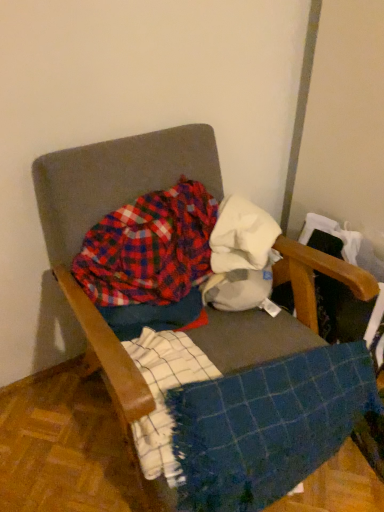
Question: In the image, is blue woven blanket at center on the left side or the right side of plaid cotton shirt at center?

Choices:
 (A) right
 (B) left

Answer: (A)

Question: Relative to plaid cotton shirt at center, is blue woven blanket at center in front or behind?

Choices:
 (A) front
 (B) behind

Answer: (A)

Question: Considering the real-world distances, which object is closest to the textured fabric chair at center?

Choices:
 (A) plaid cotton shirt at center
 (B) white cotton cloth at center
 (C) blue woven blanket at center

Answer: (A)

Question: Estimate the real-world distances between objects in this image. Which object is closer to the textured fabric chair at center?

Choices:
 (A) blue woven blanket at center
 (B) plaid cotton shirt at center
 (C) white cotton cloth at center

Answer: (B)